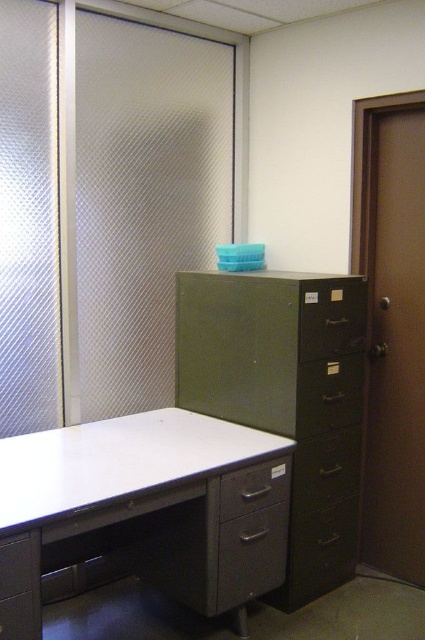
You are organizing your desk and need to locate two drawers. The metallic gray drawer at lower center and the matte gray drawer at lower center are both under the desk surface. Which drawer should you open first if you want to find something on the left side of the desk?

The metallic gray drawer at lower center is to the left of the matte gray drawer at lower center, so you should open the metallic gray drawer at lower center first to find something on the left side of the desk.

Looking at this image, you are organizing your desk and need to place a 6 inch wide box between the metallic gray drawer at lower center and the matte gray drawer at lower center. Can the box fit between them?

The metallic gray drawer at lower center and matte gray drawer at lower center are 5.85 inches apart. Since the box is 6 inches wide, it cannot fit between them as the space is slightly narrower than the box.